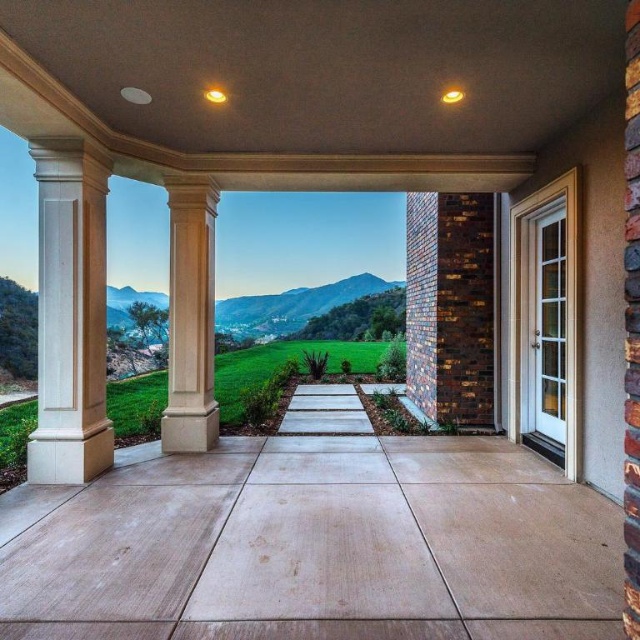
Question: Does sanded concrete porch at center lie in front of white smooth column at left?

Choices:
 (A) yes
 (B) no

Answer: (A)

Question: Which point is closer to the camera?

Choices:
 (A) (52, 532)
 (B) (195, 321)

Answer: (A)

Question: Does sanded concrete porch at center appear on the right side of green grass at center?

Choices:
 (A) no
 (B) yes

Answer: (B)

Question: Does sanded concrete porch at center appear over green grass at center?

Choices:
 (A) no
 (B) yes

Answer: (A)

Question: Which of the following is the closest to the observer?

Choices:
 (A) (176, 317)
 (B) (61, 195)
 (C) (216, 534)
 (D) (33, 310)

Answer: (C)

Question: Which of the following is the farthest from the observer?

Choices:
 (A) (99, 406)
 (B) (161, 420)
 (C) (250, 326)

Answer: (C)